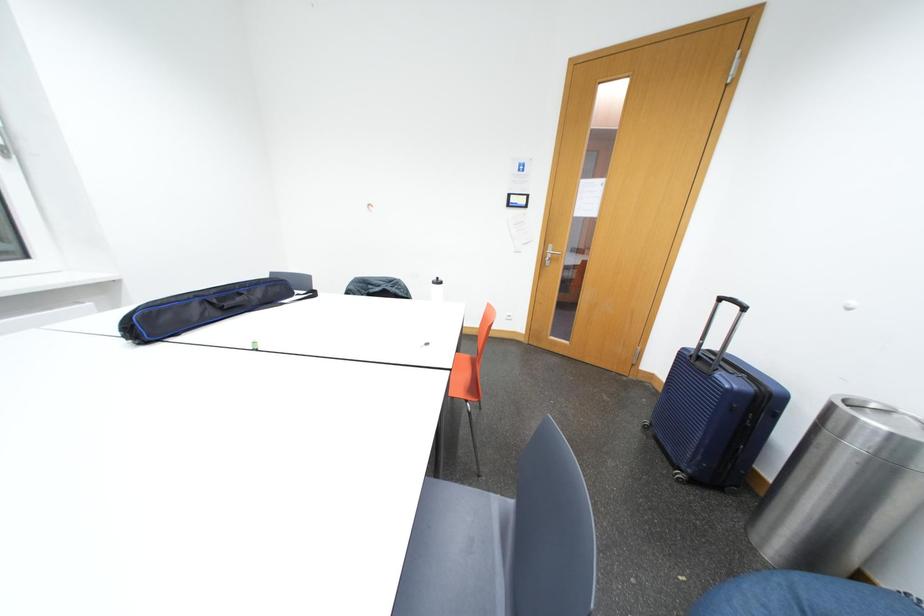
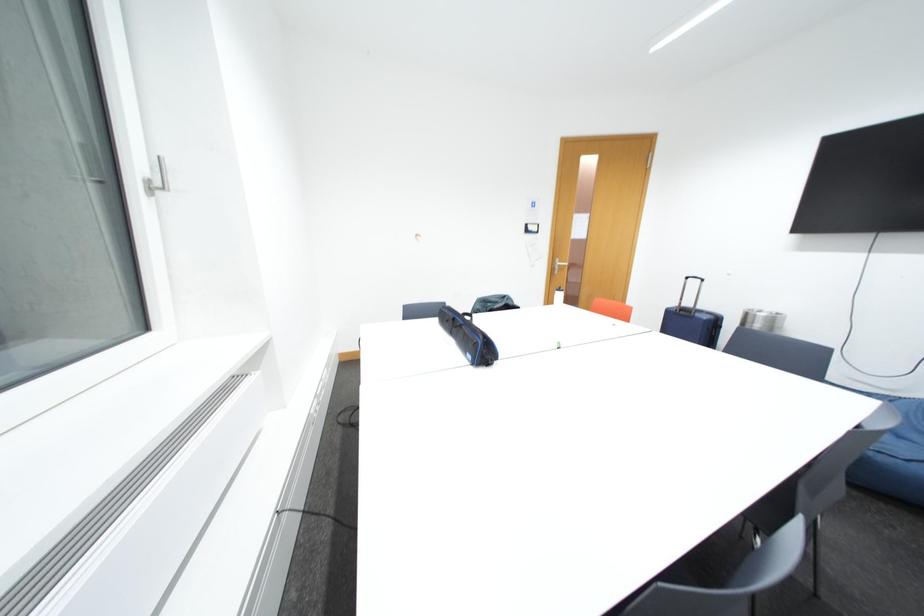
Question: Which direction would the cameraman need to move to produce the second image? Reply with the corresponding letter.

Choices:
 (A) Left
 (B) Right
 (C) Forward
 (D) Backward

Answer: (A)